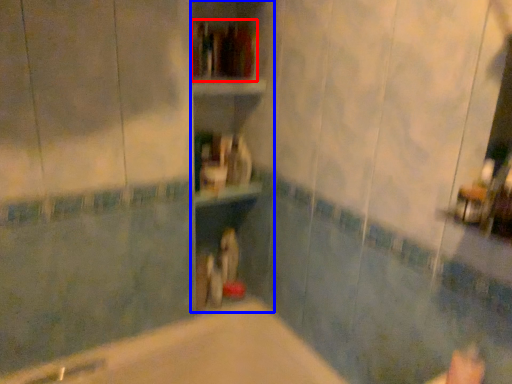
Question: Which of the following is the closest to the observer, book (highlighted by a red box) or bookshelf (highlighted by a blue box)?

Choices:
 (A) book
 (B) bookshelf

Answer: (B)